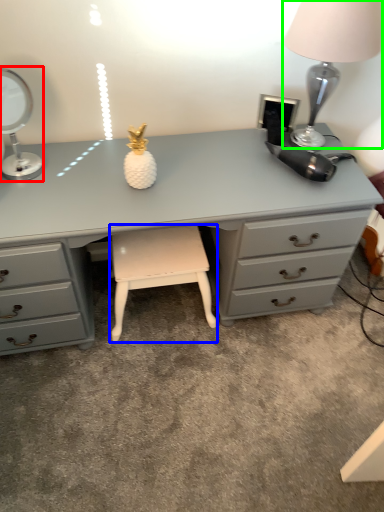
Question: Which object is the closest to the table lamp (highlighted by a red box)? Choose among these: stool (highlighted by a blue box) or table lamp (highlighted by a green box).

Choices:
 (A) stool
 (B) table lamp

Answer: (A)